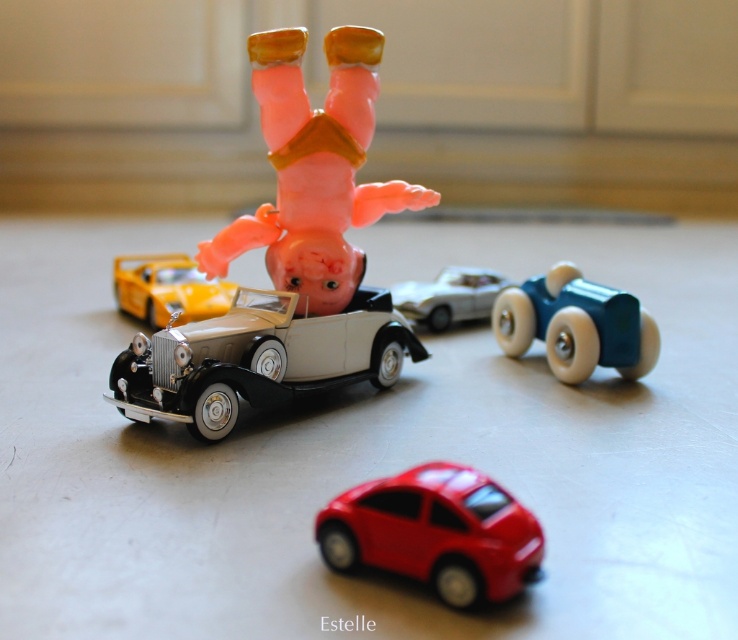
In the scene shown: You are a child trying to push the teal wooden toy car at right and the shiny yellow car at center closer together. If you move both cars towards each other by 10 centimeters each, will they touch?

The teal wooden toy car at right and the shiny yellow car at center are initially 63.80 centimeters apart. If you move each car 10 centimeters towards each other, the total distance reduced is 20 centimeters. Subtracting this from the original distance gives 63.80 cm minus 20 cm equals 43.80 centimeters remaining between them. Therefore, they will not touch as there is still space between them.

What are the coordinates of the pink rubber figure at center?

The pink rubber figure at center is located at coordinates point (314, 170).

You are organizing a toy collection and need to stack the teal wooden toy car at right and the shiny yellow car at center vertically. Which one should you place at the bottom to ensure stability?

The teal wooden toy car at right should be placed at the bottom since it is taller than the shiny yellow car at center, providing a stable base for the stack.